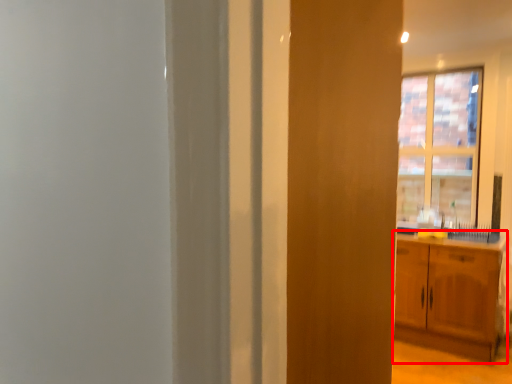
Question: From the image's perspective, where is cabinetry (annotated by the red box) located relative to window?

Choices:
 (A) below
 (B) above

Answer: (A)